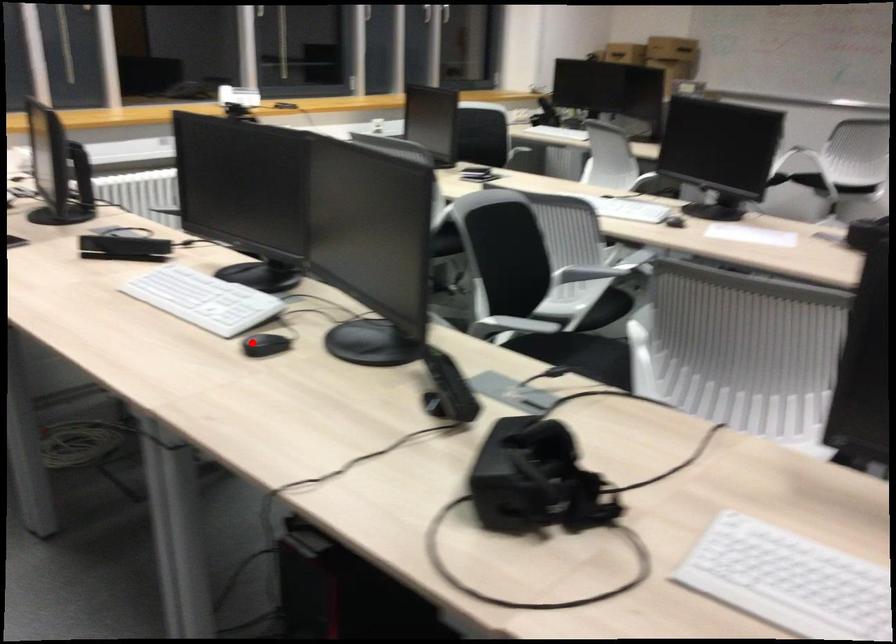
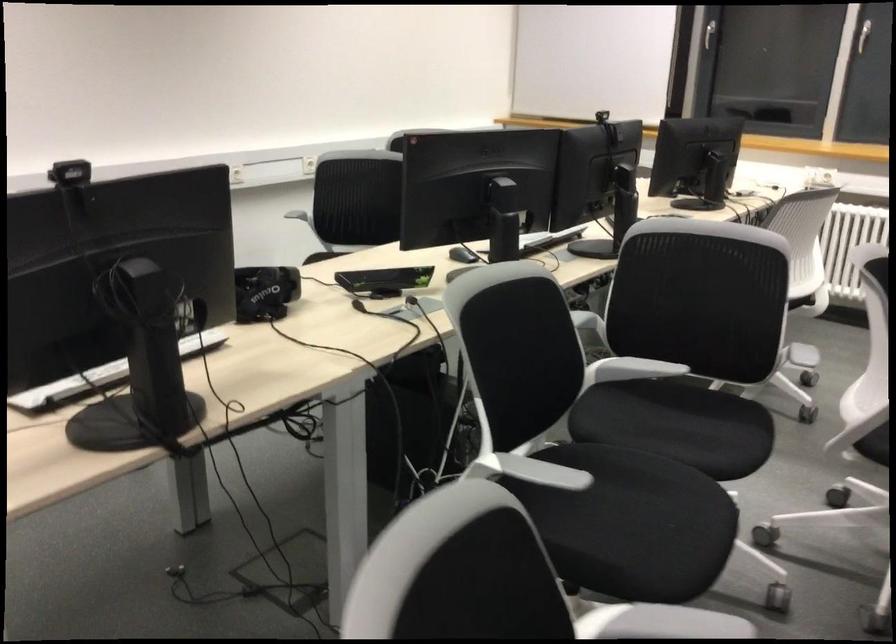
The point at the highlighted location is marked in the first image. Where is the corresponding point in the second image?

(462, 254)